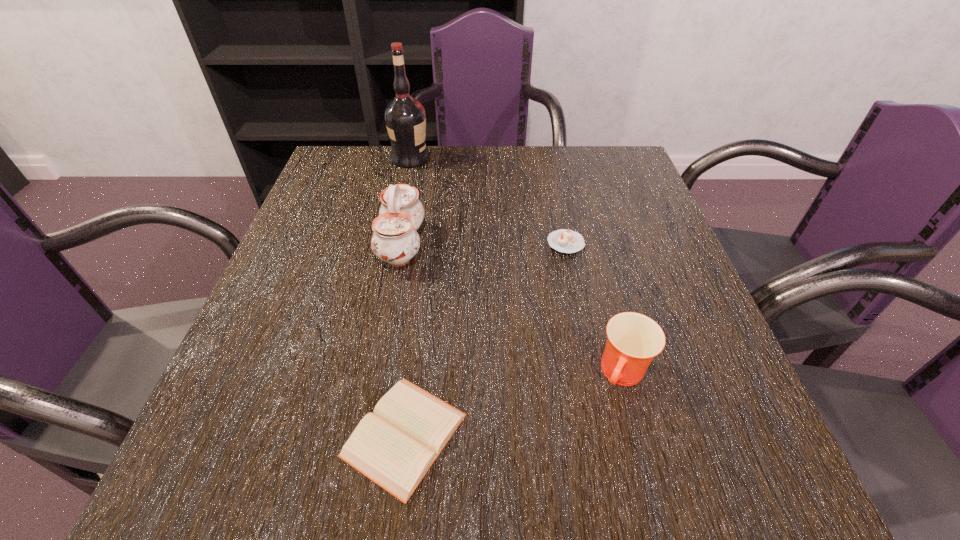
Locate an element on the screen. the tallest object is located at coordinates click(x=405, y=117).

Locate an element on the screen. the farthest object is located at coordinates (405, 117).

Identify the location of chinaware. The image size is (960, 540). (395, 240).

Find the location of a particular element. the third shortest object is located at coordinates (633, 340).

Identify the location of the second shortest object. The width and height of the screenshot is (960, 540). (563, 240).

Find the location of a particular element. the shortest object is located at coordinates (395, 446).

The height and width of the screenshot is (540, 960). I want to click on vacant region located on the surface of the tallest object, so click(x=484, y=158).

Identify the location of vacant space located 0.210m by the handle of the fourth shortest object. (519, 244).

Identify the location of vacant area located 0.190m on the back of the third shortest object. (596, 272).

At what (x,y) coordinates should I click in order to perform the action: click on free space located on the right of the second shortest object. Please return your answer as a coordinate pair (x, y). This screenshot has width=960, height=540. Looking at the image, I should click on (657, 243).